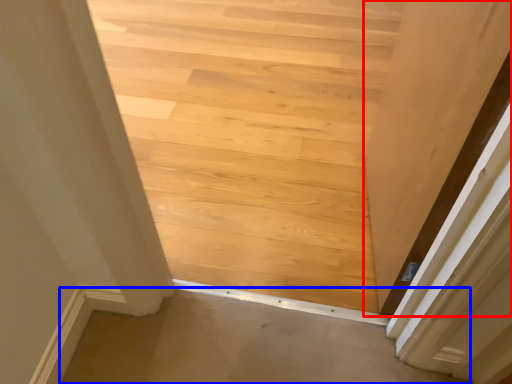
Question: Among these objects, which one is farthest to the camera, door (highlighted by a red box) or plain (highlighted by a blue box)?

Choices:
 (A) door
 (B) plain

Answer: (B)